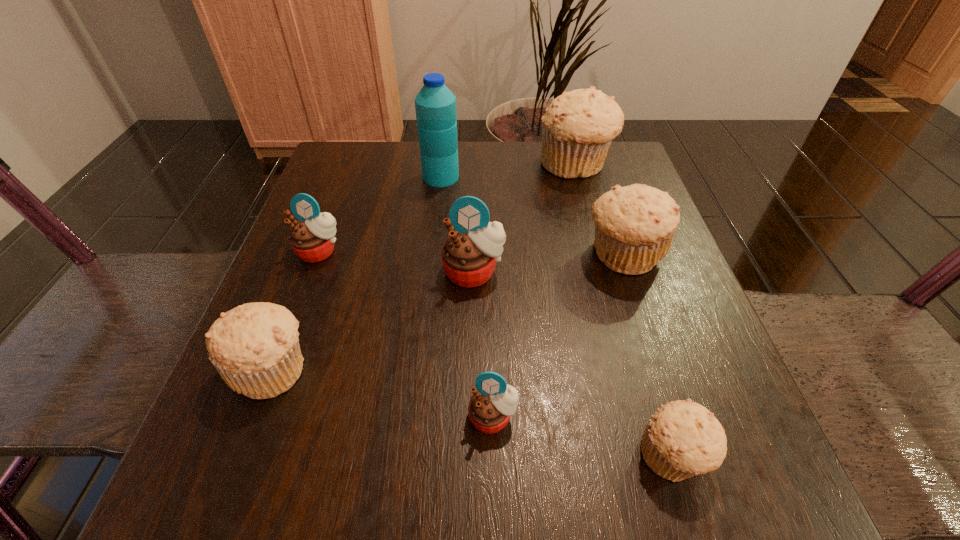
Identify which object is the fourth nearest to the water bottle. Please provide its 2D coordinates. Your answer should be formatted as a tuple, i.e. [(x, y)], where the tuple contains the x and y coordinates of a point satisfying the conditions above.

[(635, 225)]

This screenshot has height=540, width=960. I want to click on muffin that stands as the sixth closest to the biggest beige muffin, so click(255, 348).

I want to click on muffin that stands as the sixth closest to the farthest beige muffin, so click(x=255, y=348).

Locate which beige muffin is the third closest to the second farthest beige muffin. Please provide its 2D coordinates. Your answer should be formatted as a tuple, i.e. [(x, y)], where the tuple contains the x and y coordinates of a point satisfying the conditions above.

[(255, 348)]

Identify which beige muffin is located as the third nearest to the smallest beige muffin. Please provide its 2D coordinates. Your answer should be formatted as a tuple, i.e. [(x, y)], where the tuple contains the x and y coordinates of a point satisfying the conditions above.

[(577, 129)]

Identify the location of pink muffin identified as the second closest to the third smallest beige muffin. (491, 405).

Identify which pink muffin is located as the second nearest to the biggest pink muffin. Please provide its 2D coordinates. Your answer should be formatted as a tuple, i.e. [(x, y)], where the tuple contains the x and y coordinates of a point satisfying the conditions above.

[(491, 405)]

Locate an element on the screen. free space that satisfies the following two spatial constraints: 1. on the front-facing side of the smallest beige muffin; 2. on the left side of the biggest pink muffin is located at coordinates (471, 456).

I want to click on vacant area in the image that satisfies the following two spatial constraints: 1. on the front side of the water bottle; 2. on the left side of the third nearest beige muffin, so click(432, 255).

I want to click on free location that satisfies the following two spatial constraints: 1. on the back side of the farthest muffin; 2. on the right side of the third farthest beige muffin, so click(x=349, y=165).